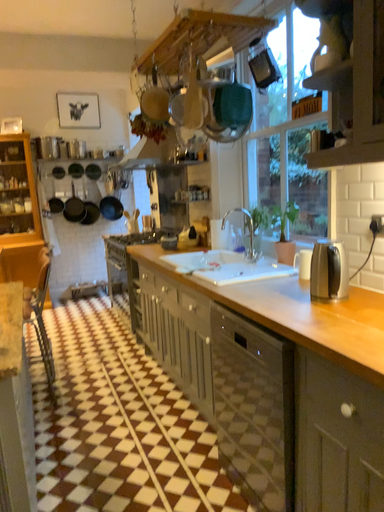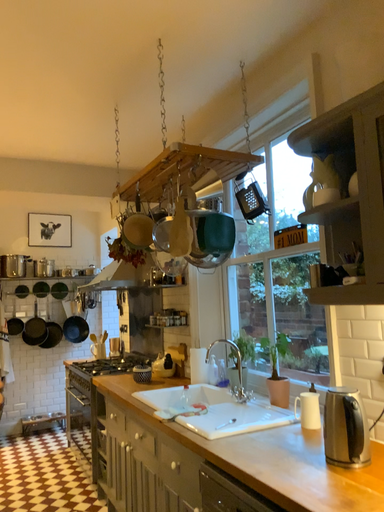
Question: Which way did the camera rotate in the video?

Choices:
 (A) rotated downward
 (B) rotated upward

Answer: (B)